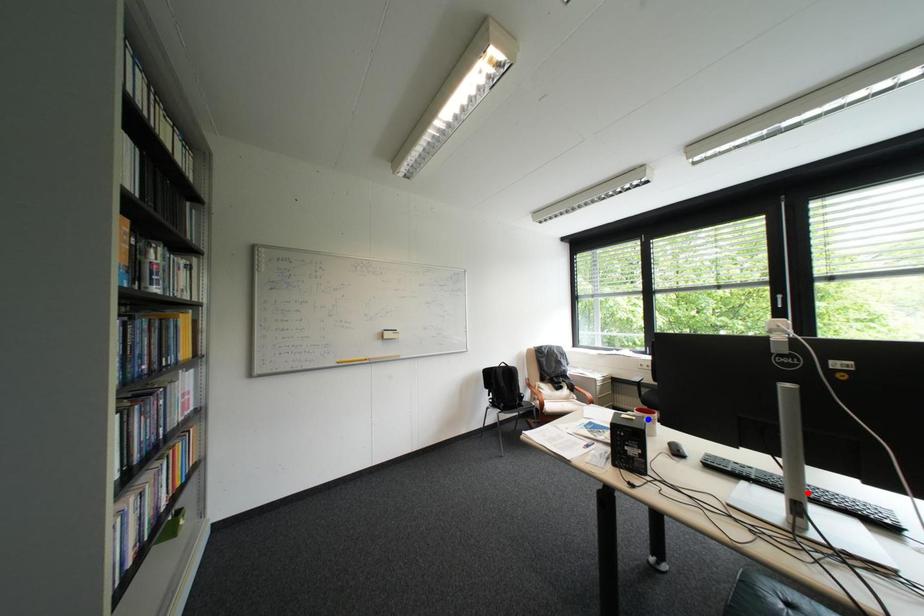
Question: Which of the two points in the image is closer to the camera?

Choices:
 (A) Blue point is closer.
 (B) Red point is closer.

Answer: (B)